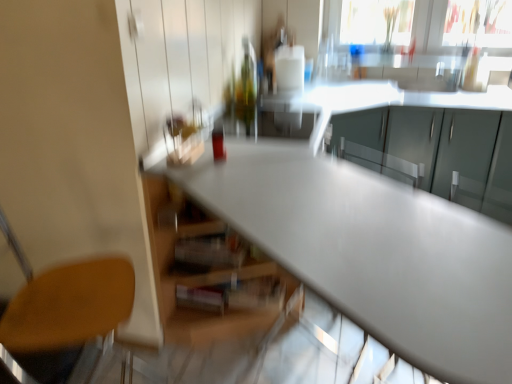
Question: Looking at the image, does satin white table at center seem bigger or smaller compared to wooden seat at lower left?

Choices:
 (A) small
 (B) big

Answer: (B)

Question: From the image's perspective, relative to wooden seat at lower left, is satin white table at center above or below?

Choices:
 (A) above
 (B) below

Answer: (A)

Question: Which is farther from the matte gray cabinets at upper right?

Choices:
 (A) transparent glass window screen at upper right
 (B) wooden seat at lower left
 (C) satin white table at center

Answer: (B)

Question: Estimate the real-world distances between objects in this image. Which object is closer to the satin white table at center?

Choices:
 (A) wooden seat at lower left
 (B) matte gray cabinets at upper right
 (C) transparent glass window screen at upper right

Answer: (A)